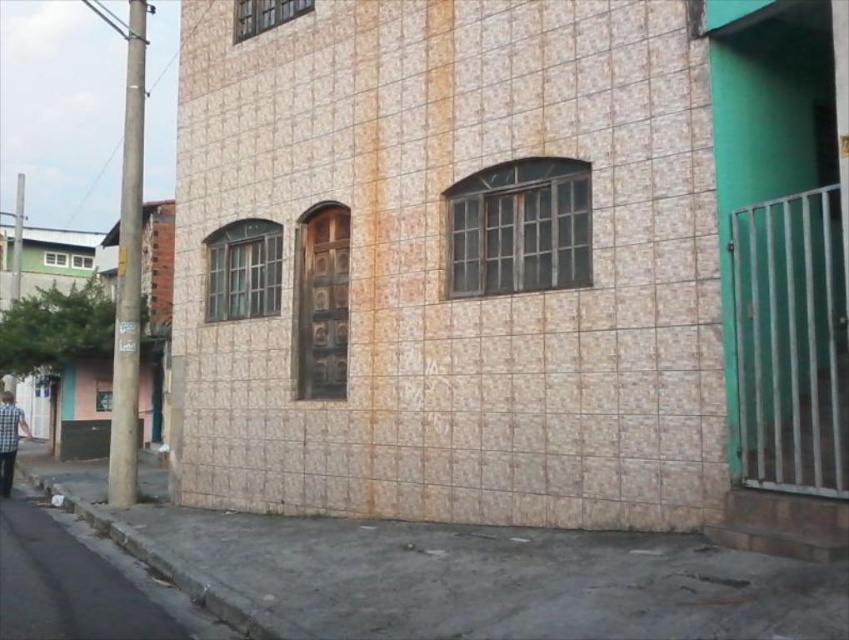
Question: Is rusty metal window at center bigger than matte glass window at center?

Choices:
 (A) no
 (B) yes

Answer: (B)

Question: Is gray concrete curb at lower left to the right of matte glass window at center from the viewer's perspective?

Choices:
 (A) yes
 (B) no

Answer: (A)

Question: Which of these objects is positioned closest to the matte glass window at upper left?

Choices:
 (A) checkered fabric shirt at lower left
 (B) rusty metal window at center
 (C) gray concrete pavement at lower left
 (D) brown wooden door at center

Answer: (A)

Question: Which point is farther to the camera?

Choices:
 (A) brown wooden door at center
 (B) matte glass window at center

Answer: (B)

Question: Which point appears closest to the camera in this image?

Choices:
 (A) (1, 477)
 (B) (225, 275)
 (C) (583, 209)

Answer: (C)

Question: Is the position of rusty metal window at center more distant than that of matte glass window at center?

Choices:
 (A) yes
 (B) no

Answer: (B)